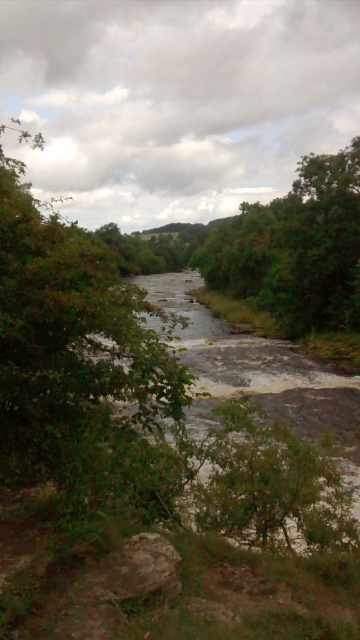
Question: Among these points, which one is nearest to the camera?

Choices:
 (A) (204, 397)
 (B) (327, 272)

Answer: (A)

Question: Which point appears closest to the camera in this image?

Choices:
 (A) (354, 484)
 (B) (24, 433)
 (C) (336, 186)

Answer: (B)

Question: Does rough textured stream at center have a lesser width compared to green leafy tree at center?

Choices:
 (A) no
 (B) yes

Answer: (B)

Question: Does rough textured stream at center have a greater width compared to green leafy tree at center?

Choices:
 (A) yes
 (B) no

Answer: (B)

Question: Does rough textured stream at center appear over green leafy tree at center?

Choices:
 (A) no
 (B) yes

Answer: (A)

Question: Which object is the farthest from the green leafy tree at center?

Choices:
 (A) green leafy tree at left
 (B) rough textured stream at center

Answer: (A)